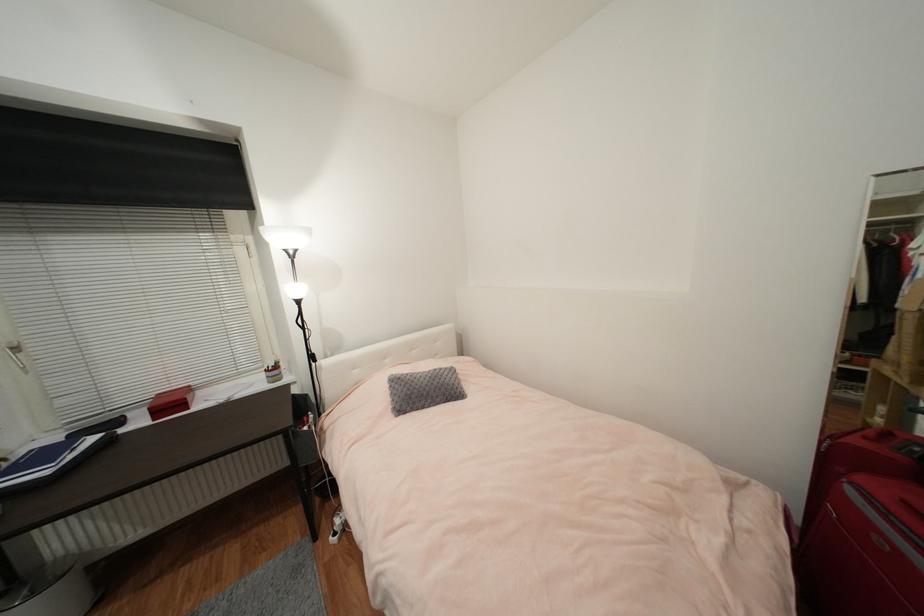
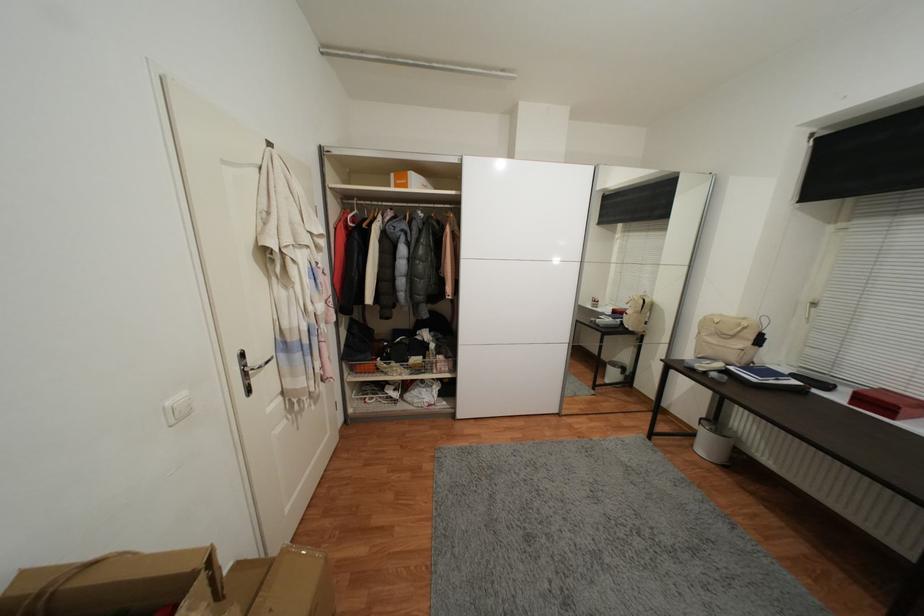
In the second image, find the point that corresponds to pixel 52 474 in the first image.

(759, 381)